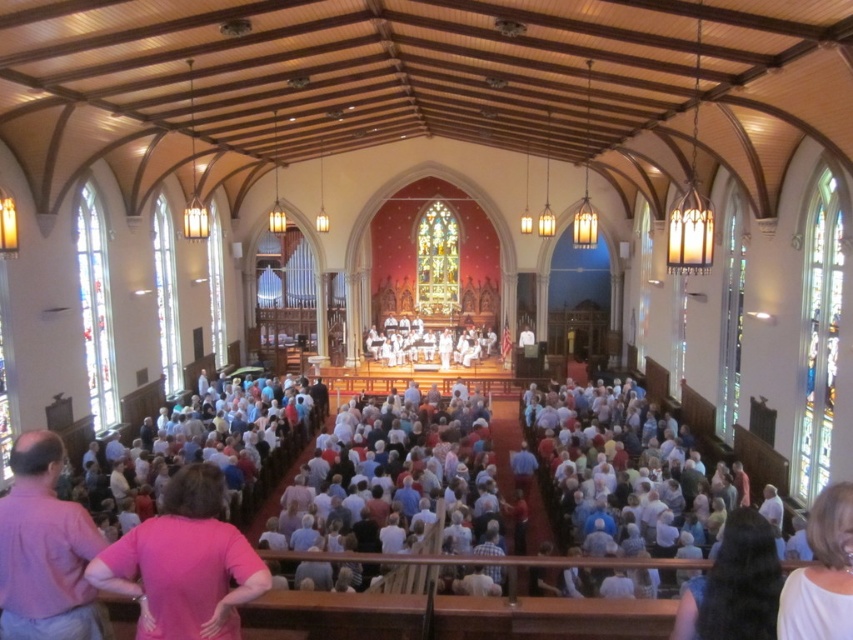
Question: Considering the relative positions of pink shirt at lower left and dark brown hair at lower right in the image provided, where is pink shirt at lower left located with respect to dark brown hair at lower right?

Choices:
 (A) above
 (B) below

Answer: (A)

Question: Can you confirm if pink shirt at lower left is smaller than dark brown hair at lower right?

Choices:
 (A) yes
 (B) no

Answer: (B)

Question: Is dark brown hair at lower right smaller than white matte shirt at lower right?

Choices:
 (A) no
 (B) yes

Answer: (A)

Question: Among these objects, which one is farthest from the camera?

Choices:
 (A) pink fabric shirt at lower left
 (B) dark brown hair at lower right
 (C) white matte shirt at lower right

Answer: (A)

Question: Considering the real-world distances, which object is closest to the pink shirt at lower left?

Choices:
 (A) white matte shirt at lower right
 (B) pink fabric shirt at lower left

Answer: (B)

Question: Which point appears farthest from the camera in this image?

Choices:
 (A) [190, 618]
 (B) [851, 564]
 (C) [764, 518]

Answer: (C)